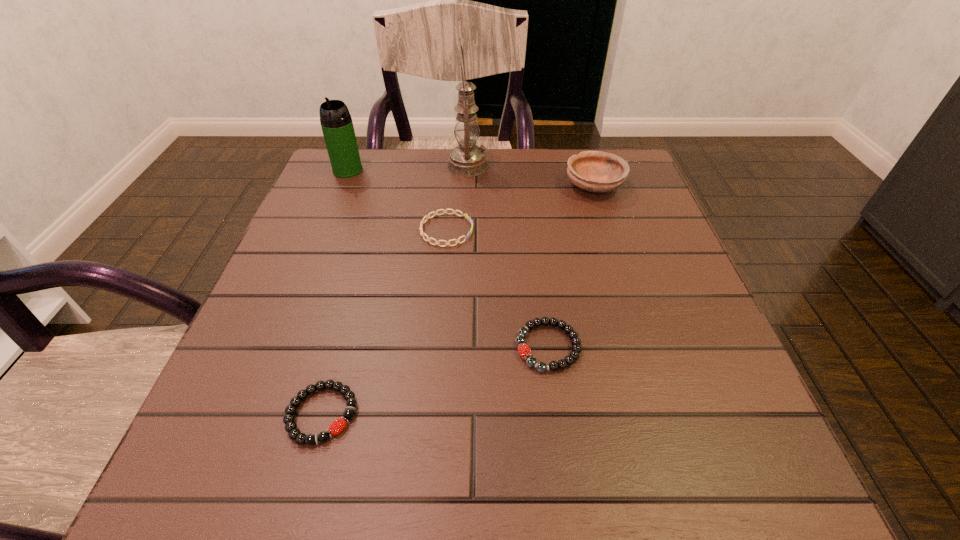
In order to click on vacant area between the tallest object and the nearest bracelet in this screenshot , I will do `click(395, 290)`.

This screenshot has height=540, width=960. In order to click on free spot between the second object from right to left and the fourth shortest object in this screenshot , I will do `click(571, 266)`.

The width and height of the screenshot is (960, 540). Find the location of `blank region between the leftmost object and the third nearest object`. blank region between the leftmost object and the third nearest object is located at coordinates (397, 200).

At what (x,y) coordinates should I click in order to perform the action: click on free space between the rightmost object and the second bracelet from right to left. Please return your answer as a coordinate pair (x, y). This screenshot has width=960, height=540. Looking at the image, I should click on (520, 208).

Identify the location of free point between the rightmost object and the tallest object. (531, 176).

Where is `object that stands as the fourth closest to the third nearest object`? The height and width of the screenshot is (540, 960). object that stands as the fourth closest to the third nearest object is located at coordinates (595, 171).

The width and height of the screenshot is (960, 540). I want to click on the second closest object to the fifth shortest object, so click(x=444, y=211).

Select which bracelet appears as the second closest to the fifth farthest object. Please provide its 2D coordinates. Your answer should be formatted as a tuple, i.e. [(x, y)], where the tuple contains the x and y coordinates of a point satisfying the conditions above.

[(335, 428)]

This screenshot has width=960, height=540. Find the location of `the closest bracelet to the second farthest bracelet`. the closest bracelet to the second farthest bracelet is located at coordinates (444, 211).

Identify the location of vacant region that satisfies the following two spatial constraints: 1. on the back side of the nearest bracelet; 2. on the left side of the rightmost object. (384, 186).